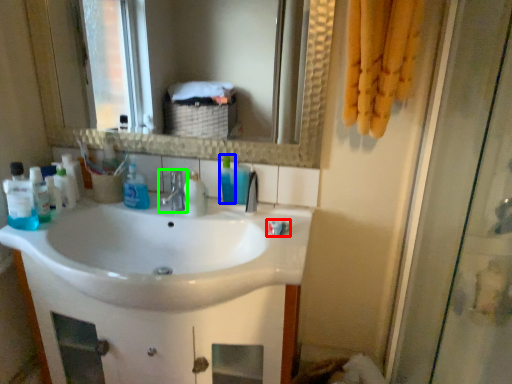
Question: Estimate the real-world distances between objects in this image. Which object is farther from toothpaste (highlighted by a red box), cleaning product (highlighted by a blue box) or tap (highlighted by a green box)?

Choices:
 (A) cleaning product
 (B) tap

Answer: (B)